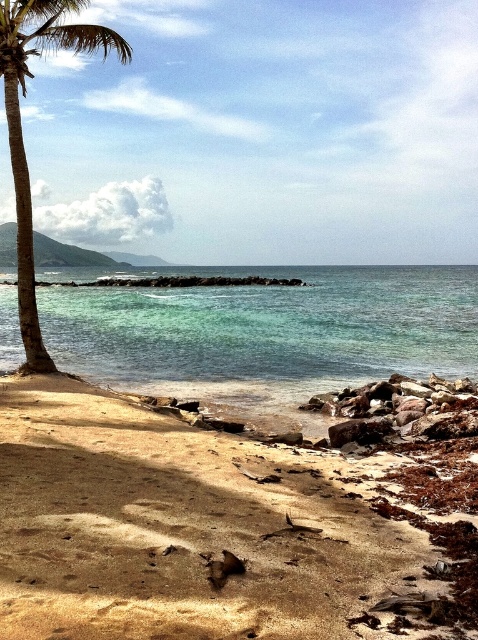
Which is below, green leafy palm tree at left or rusty metallic rocks at lower right?

Positioned lower is rusty metallic rocks at lower right.

Is green leafy palm tree at left above rusty metallic rocks at lower right?

Yes.

The height and width of the screenshot is (640, 478). Describe the element at coordinates (21, 125) in the screenshot. I see `green leafy palm tree at left` at that location.

This screenshot has height=640, width=478. Find the location of `green leafy palm tree at left`. green leafy palm tree at left is located at coordinates (21, 125).

Does point (322, 301) lie behind point (336, 403)?

Yes.

This screenshot has height=640, width=478. Describe the element at coordinates (271, 328) in the screenshot. I see `clear blue water at center` at that location.

You are a GUI agent. You are given a task and a screenshot of the screen. Output one action in this format:
    pyautogui.click(x=<x>, y=<y>)
    Task: Click on the clear blue water at center
    This screenshot has height=640, width=478.
    Given the screenshot: What is the action you would take?
    pyautogui.click(x=271, y=328)

Is brown sandy beach at lower left shorter than rusty metallic rocks at lower right?

In fact, brown sandy beach at lower left may be taller than rusty metallic rocks at lower right.

Can you confirm if brown sandy beach at lower left is taller than rusty metallic rocks at lower right?

Indeed, brown sandy beach at lower left has a greater height compared to rusty metallic rocks at lower right.

Identify the location of brown sandy beach at lower left. (229, 522).

This screenshot has height=640, width=478. Find the location of `brown sandy beach at lower left`. brown sandy beach at lower left is located at coordinates (229, 522).